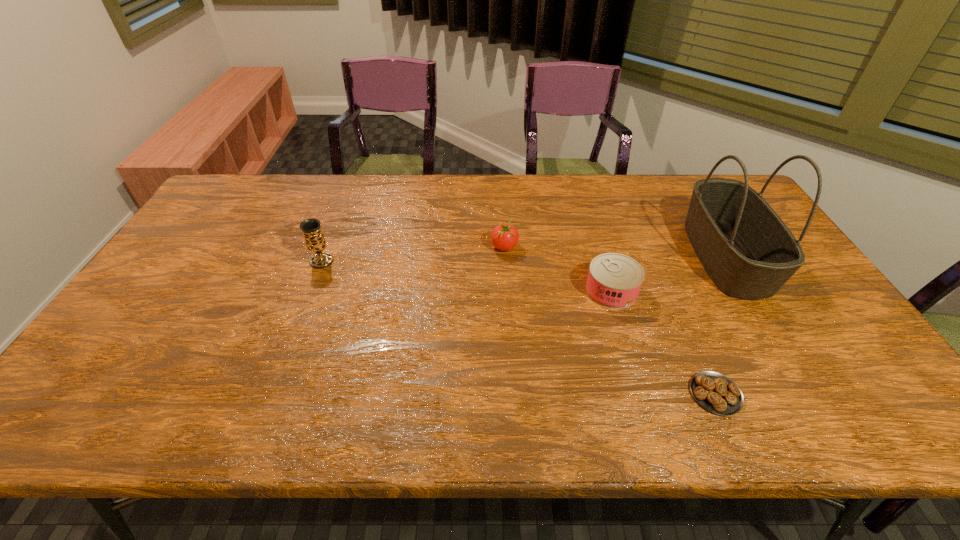
This screenshot has height=540, width=960. In order to click on the tallest object in this screenshot , I will do `click(747, 250)`.

The height and width of the screenshot is (540, 960). Identify the location of basket. (747, 250).

Identify the location of the leftmost object. Image resolution: width=960 pixels, height=540 pixels. (311, 228).

This screenshot has height=540, width=960. I want to click on the fourth shortest object, so [311, 228].

Find the location of `tomato`. tomato is located at coordinates (505, 237).

I want to click on the third object from right to left, so click(614, 280).

This screenshot has height=540, width=960. I want to click on pastry, so click(715, 392).

Find the location of a particular element. This screenshot has width=960, height=540. the second object from right to left is located at coordinates (715, 392).

At what (x,y) coordinates should I click in order to perform the action: click on vacant space situated 0.190m on the back of the tallest object. Please return your answer as a coordinate pair (x, y). The width and height of the screenshot is (960, 540). Looking at the image, I should click on (683, 183).

At what (x,y) coordinates should I click in order to perform the action: click on vacant area located 0.200m on the right of the fourth shortest object. Please return your answer as a coordinate pair (x, y). The height and width of the screenshot is (540, 960). Looking at the image, I should click on (401, 261).